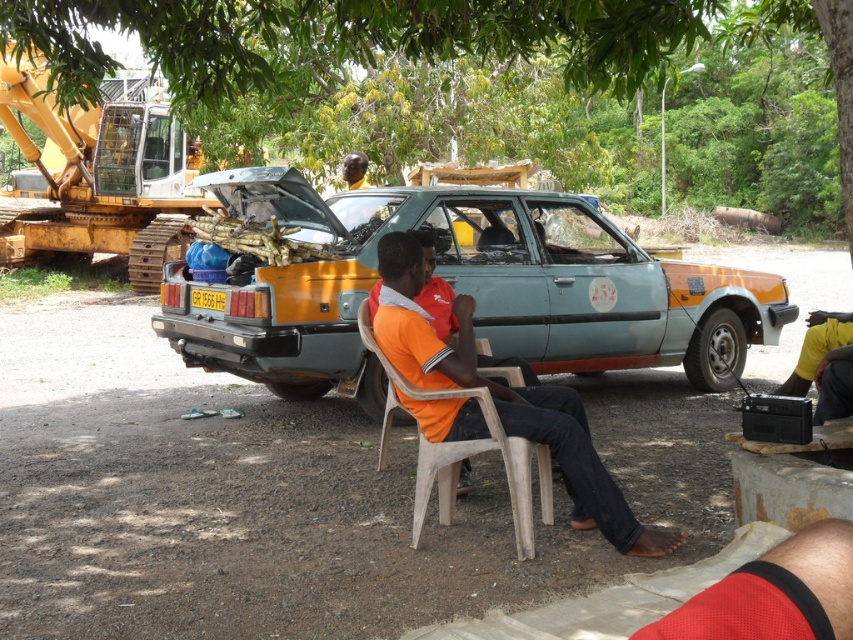
Based on the scene description, what are the coordinates of the teal matte car at center?

The teal matte car at center is located at coordinates point [462,289].

You are a delivery driver who needs to park your teal matte car at center in a parking spot that can only accommodate vehicles smaller than the green leafy tree at upper center. Can you park your car there?

The teal matte car at center has a larger size compared to the green leafy tree at upper center, so it cannot fit in the parking spot designed for smaller vehicles.